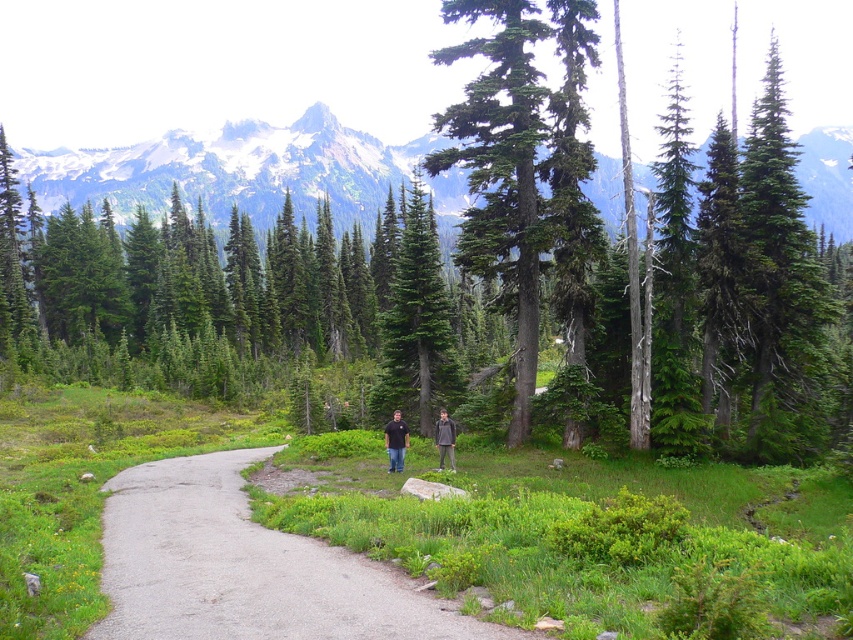
You are standing at the point marked by the coordinates point (416, 321). Looking around, you see a dense forest of coniferous trees. Which direction should you walk to find the nearest green matte tree at center?

The point marked by the coordinates point (416, 321) is exactly where the green matte tree at center is located, so you are already at the tree.

Looking at this image, what can be found at the point with coordinates (234, 170) in the image?

At point (234, 170) lies green coniferous forest at upper center.

You are a hiker standing on the path and see the green matte tree at center and the black cotton shirt at center. Which object is positioned to the left?

The green matte tree at center is to the left of the black cotton shirt at center.